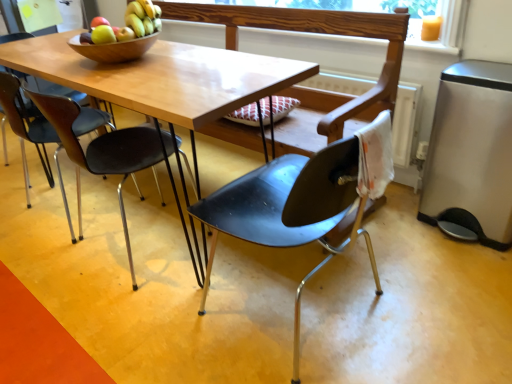
Question: Does wooden frame at upper center have a greater width compared to black plastic chair at left, the 2th chair viewed from the left?

Choices:
 (A) no
 (B) yes

Answer: (A)

Question: Does wooden frame at upper center have a larger size compared to black plastic chair at left, which appears as the second chair when viewed from the right?

Choices:
 (A) no
 (B) yes

Answer: (A)

Question: Is the position of wooden frame at upper center less distant than that of black plastic chair at left, the 2th chair viewed from the left?

Choices:
 (A) no
 (B) yes

Answer: (A)

Question: Is wooden frame at upper center taller than black plastic chair at left, the 2th chair viewed from the left?

Choices:
 (A) yes
 (B) no

Answer: (B)

Question: Is wooden frame at upper center completely or partially outside of black plastic chair at left, which appears as the second chair when viewed from the right?

Choices:
 (A) no
 (B) yes

Answer: (B)

Question: In terms of height, does stainless steel trash can at right look taller or shorter compared to matte black chair at left, the 1th chair when ordered from left to right?

Choices:
 (A) short
 (B) tall

Answer: (A)

Question: Visually, is stainless steel trash can at right positioned to the left or to the right of matte black chair at left, acting as the 3th chair starting from the right?

Choices:
 (A) left
 (B) right

Answer: (B)

Question: Considering the positions of stainless steel trash can at right and matte black chair at left, the 1th chair when ordered from left to right, in the image, is stainless steel trash can at right bigger or smaller than matte black chair at left, the 1th chair when ordered from left to right,?

Choices:
 (A) small
 (B) big

Answer: (A)

Question: Is stainless steel trash can at right in front of or behind matte black chair at left, the 1th chair when ordered from left to right, in the image?

Choices:
 (A) behind
 (B) front

Answer: (B)

Question: Considering the positions of wooden frame at upper center and stainless steel trash can at right in the image, is wooden frame at upper center taller or shorter than stainless steel trash can at right?

Choices:
 (A) tall
 (B) short

Answer: (B)

Question: Based on their sizes in the image, would you say wooden frame at upper center is bigger or smaller than stainless steel trash can at right?

Choices:
 (A) small
 (B) big

Answer: (A)

Question: Looking at their shapes, would you say wooden frame at upper center is wider or thinner than stainless steel trash can at right?

Choices:
 (A) thin
 (B) wide

Answer: (A)

Question: In the image, is wooden frame at upper center positioned in front of or behind stainless steel trash can at right?

Choices:
 (A) front
 (B) behind

Answer: (B)

Question: Is point (161, 157) positioned closer to the camera than point (327, 218)?

Choices:
 (A) closer
 (B) farther

Answer: (B)

Question: From a real-world perspective, is black plastic chair at left, which appears as the second chair when viewed from the right, above or below matte black chair at center, acting as the 1th chair starting from the right?

Choices:
 (A) below
 (B) above

Answer: (A)